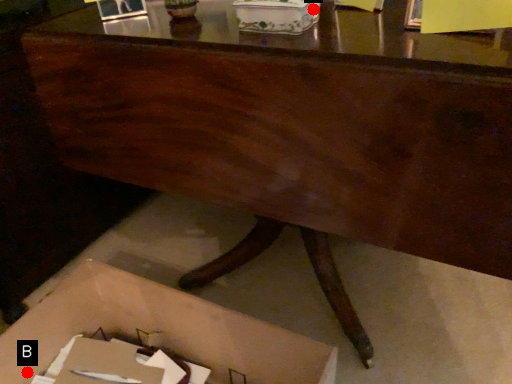
Question: Two points are circled on the image, labeled by A and B beside each circle. Which of the following is the farthest from the observer?

Choices:
 (A) A is further
 (B) B is further

Answer: (B)